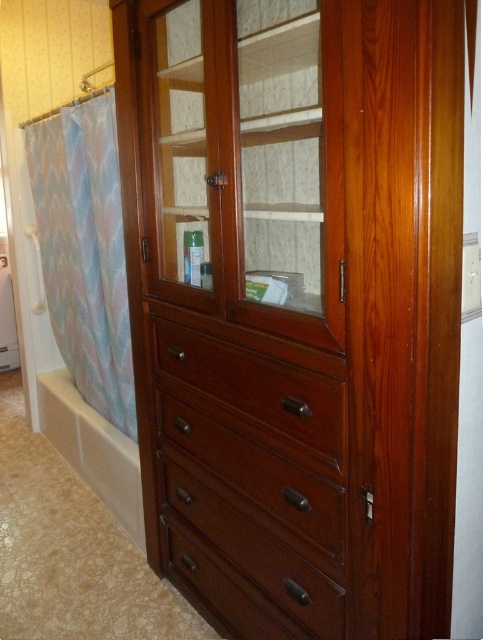
Can you confirm if polished wood armoire at center is positioned to the left of transparent wood cabinet at center?

In fact, polished wood armoire at center is to the right of transparent wood cabinet at center.

Does polished wood armoire at center have a greater width compared to transparent wood cabinet at center?

Correct, the width of polished wood armoire at center exceeds that of transparent wood cabinet at center.

Measure the distance between point (282,330) and camera.

1.30 meters

The image size is (483, 640). Identify the location of polished wood armoire at center. (306, 337).

Who is more forward, (275, 326) or (111, 372)?

Positioned in front is point (275, 326).

Based on the photo, who is shorter, transparent wood cabinet at center or pastel fabric shower curtain at left?

Standing shorter between the two is transparent wood cabinet at center.

Does point (302, 260) come in front of point (116, 275)?

Yes.

Find the location of a particular element. The image size is (483, 640). transparent wood cabinet at center is located at coordinates 246,161.

Does dark wood drawer at center appear over mahogany drawer at center?

Incorrect, dark wood drawer at center is not positioned above mahogany drawer at center.

Can you confirm if dark wood drawer at center is positioned below mahogany drawer at center?

Correct, dark wood drawer at center is located below mahogany drawer at center.

The width and height of the screenshot is (483, 640). Describe the element at coordinates (254, 474) in the screenshot. I see `dark wood drawer at center` at that location.

You are a GUI agent. You are given a task and a screenshot of the screen. Output one action in this format:
    pyautogui.click(x=<x>, y=<y>)
    Task: Click on the dark wood drawer at center
    This screenshot has width=483, height=640.
    Given the screenshot: What is the action you would take?
    click(x=254, y=474)